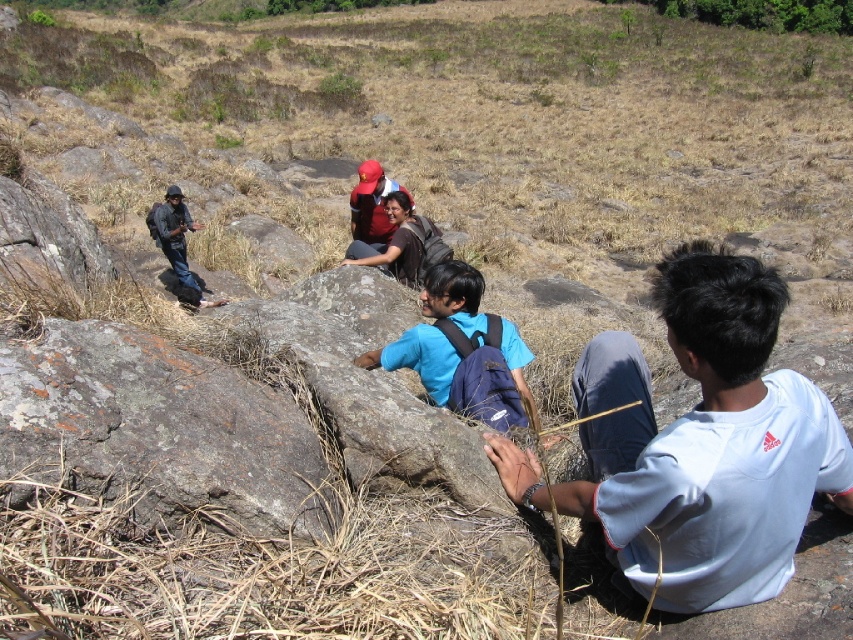
Can you confirm if white cotton shirt at lower right is positioned to the right of rusty stone boulder at left?

Yes, white cotton shirt at lower right is to the right of rusty stone boulder at left.

Can you confirm if white cotton shirt at lower right is thinner than rusty stone boulder at left?

Incorrect, white cotton shirt at lower right's width is not less than rusty stone boulder at left's.

This screenshot has height=640, width=853. I want to click on white cotton shirt at lower right, so click(x=706, y=442).

I want to click on white cotton shirt at lower right, so 706,442.

Is white cotton shirt at lower right positioned before blue fabric backpack at center?

Yes, white cotton shirt at lower right is in front of blue fabric backpack at center.

Measure the distance from white cotton shirt at lower right to blue fabric backpack at center.

They are 1.16 meters apart.

Where is `white cotton shirt at lower right`? white cotton shirt at lower right is located at coordinates (706, 442).

You are a GUI agent. You are given a task and a screenshot of the screen. Output one action in this format:
    pyautogui.click(x=<x>, y=<y>)
    Task: Click on the white cotton shirt at lower right
    This screenshot has height=640, width=853.
    Given the screenshot: What is the action you would take?
    pyautogui.click(x=706, y=442)

Which is more to the left, rusty stone boulder at left or blue fabric backpack at center?

rusty stone boulder at left

You are a GUI agent. You are given a task and a screenshot of the screen. Output one action in this format:
    pyautogui.click(x=<x>, y=<y>)
    Task: Click on the rusty stone boulder at left
    
    Given the screenshot: What is the action you would take?
    pyautogui.click(x=157, y=433)

What are the coordinates of `rusty stone boulder at left` in the screenshot? It's located at (157, 433).